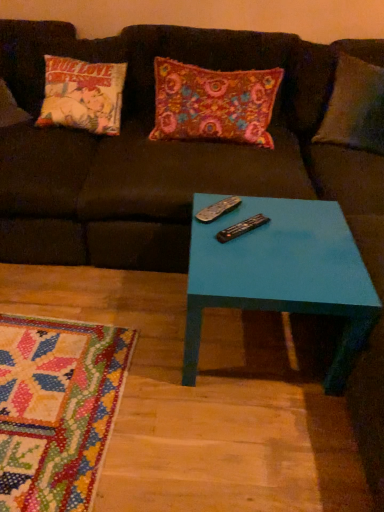
The width and height of the screenshot is (384, 512). Identify the location of free space to the left of black plastic remote at center, the 2th remote in the back-to-front sequence. (205, 233).